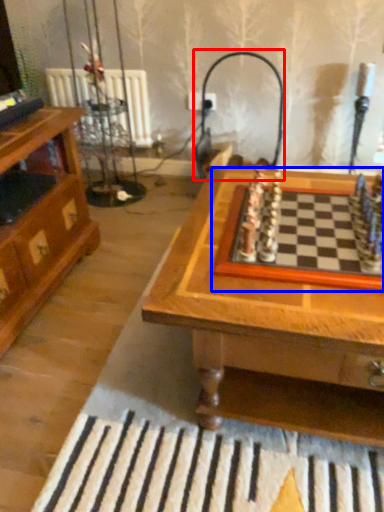
Question: Which object appears farthest to the camera in this image, lamp (highlighted by a red box) or board game (highlighted by a blue box)?

Choices:
 (A) lamp
 (B) board game

Answer: (A)